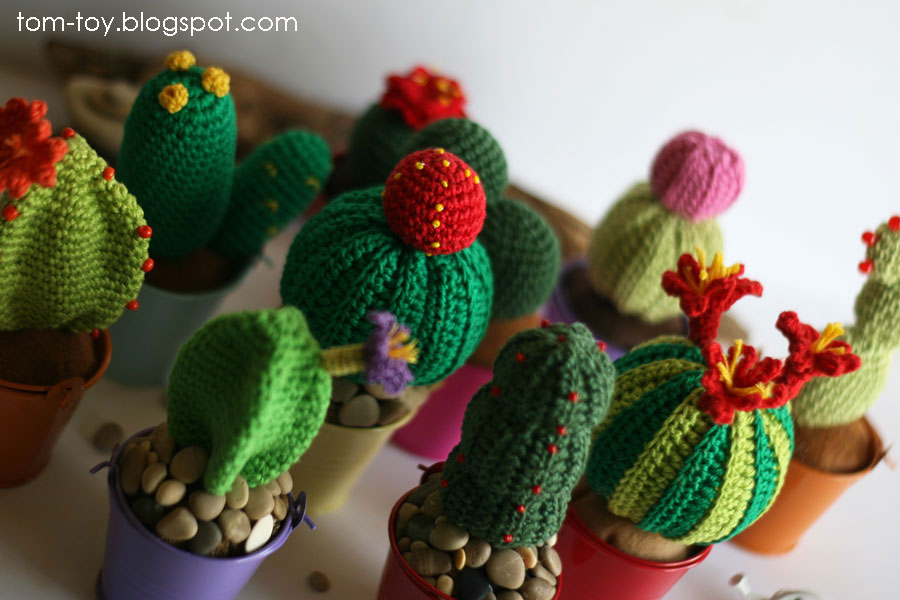
Locate an element on the screen. The width and height of the screenshot is (900, 600). orange pot is located at coordinates (40, 434).